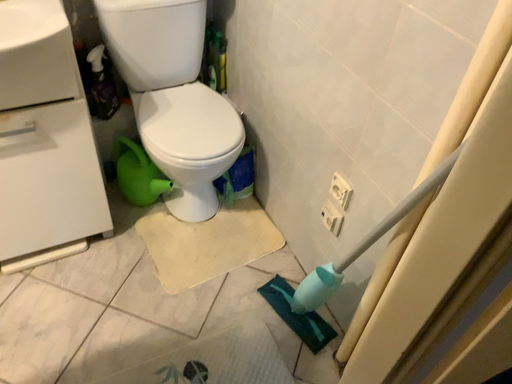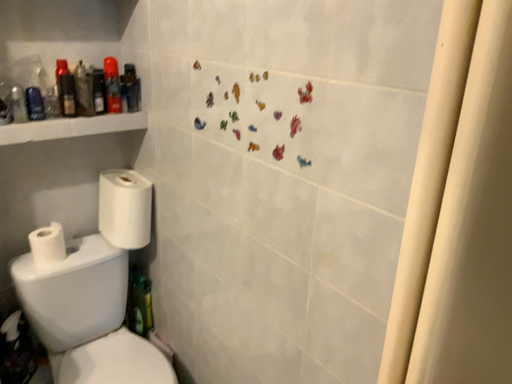
Question: How did the camera likely rotate when shooting the video?

Choices:
 (A) rotated upward
 (B) rotated downward

Answer: (A)